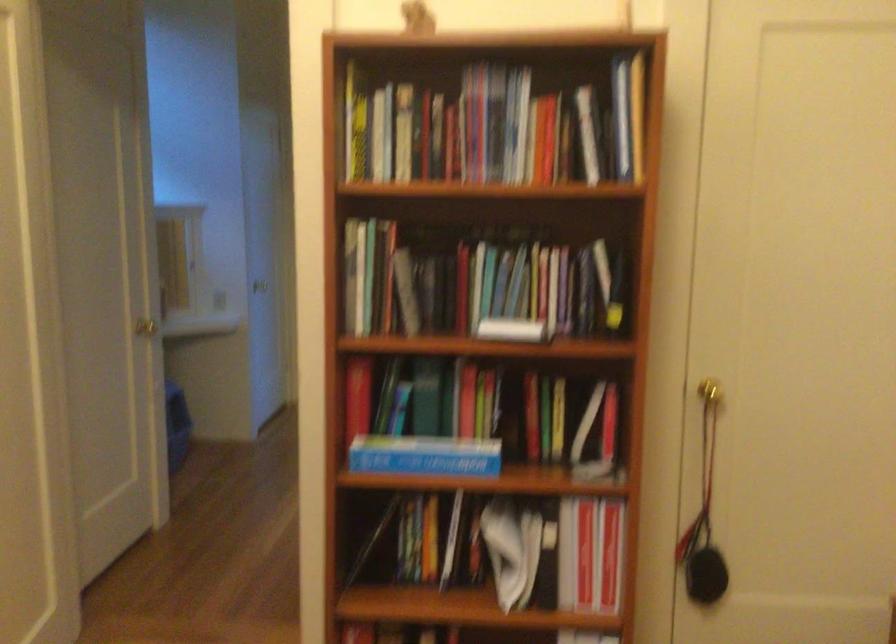
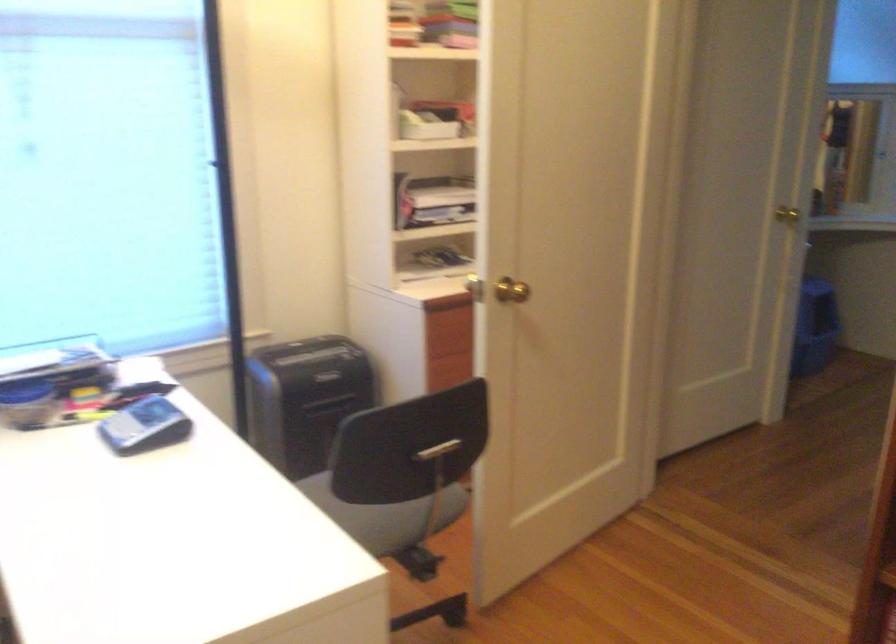
Question: The camera is either moving clockwise (left) or counter-clockwise (right) around the object. The first image is from the beginning of the video and the second image is from the end. Is the camera moving left or right when shooting the video?

Choices:
 (A) Left
 (B) Right

Answer: (B)